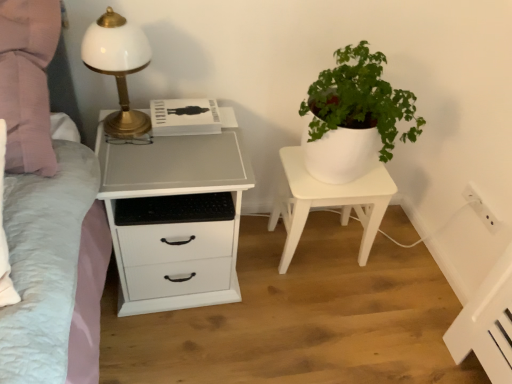
This screenshot has height=384, width=512. What are the coordinates of `free space above white matte chest of drawers at left (from a real-world perspective)` in the screenshot? It's located at (176, 149).